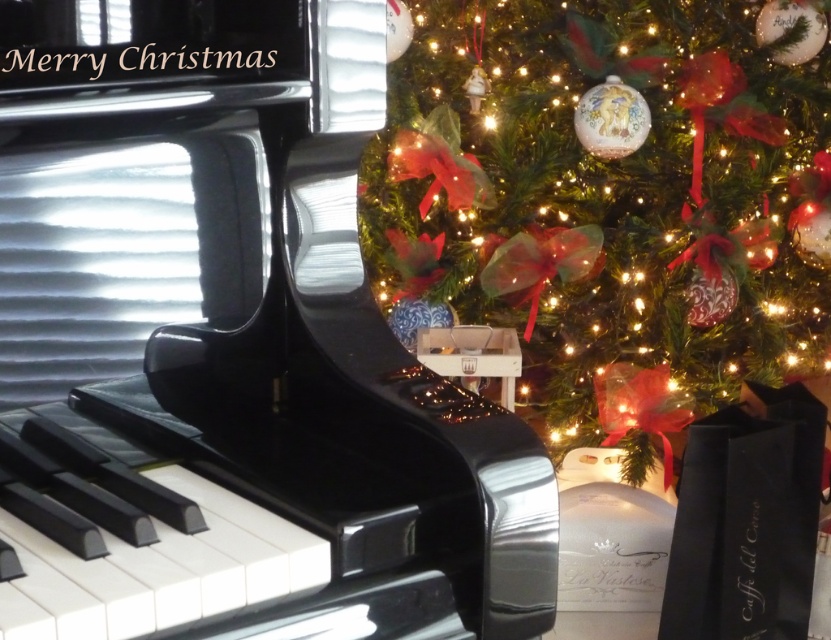
Question: Is glossy black piano at center smaller than green matte christmas tree at upper right?

Choices:
 (A) no
 (B) yes

Answer: (B)

Question: Which object appears closest to the camera in this image?

Choices:
 (A) glossy black piano at center
 (B) green matte christmas tree at upper right

Answer: (A)

Question: Does glossy black piano at center have a lesser width compared to green matte christmas tree at upper right?

Choices:
 (A) yes
 (B) no

Answer: (A)

Question: Does glossy black piano at center have a greater width compared to green matte christmas tree at upper right?

Choices:
 (A) no
 (B) yes

Answer: (A)

Question: Which point appears farthest from the camera in this image?

Choices:
 (A) (166, 560)
 (B) (774, 262)

Answer: (B)